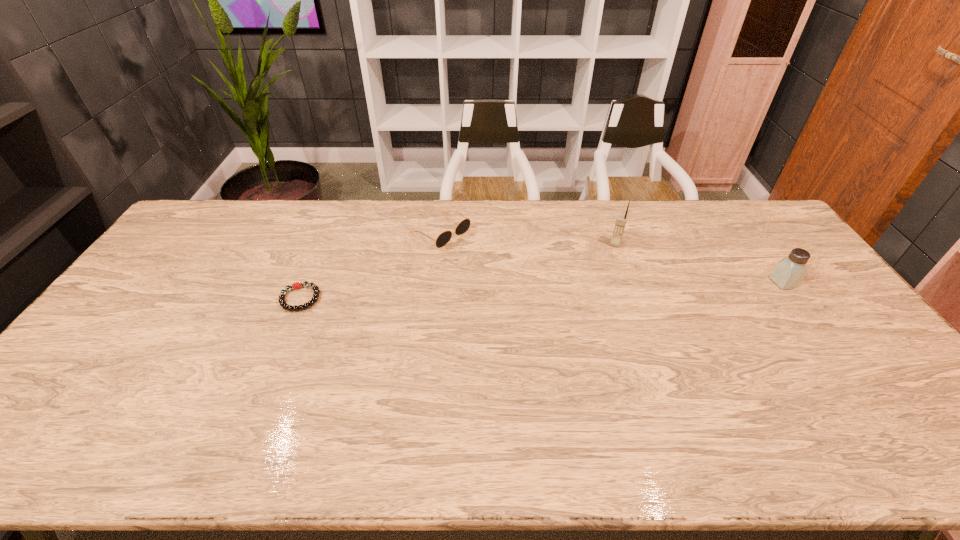
Locate an element on the screen. blank space located 0.360m on the front-facing side of the second object from left to right is located at coordinates (546, 296).

Find the location of `vacant point located on the front-facing side of the second object from left to right`. vacant point located on the front-facing side of the second object from left to right is located at coordinates (523, 282).

Image resolution: width=960 pixels, height=540 pixels. Find the location of `free region located on the front-facing side of the second object from left to right`. free region located on the front-facing side of the second object from left to right is located at coordinates (533, 288).

You are a GUI agent. You are given a task and a screenshot of the screen. Output one action in this format:
    pyautogui.click(x=<x>, y=<y>)
    Task: Click on the vacant space located on the front of the third object from left to right, where the keypad is located
    This screenshot has width=960, height=540.
    Given the screenshot: What is the action you would take?
    pyautogui.click(x=604, y=273)

Identify the location of free region located on the front of the third object from left to right, where the keypad is located. The width and height of the screenshot is (960, 540). (584, 325).

In order to click on vacant space positioned 0.230m on the front of the third object from left to right, where the keypad is located in this screenshot , I will do `click(597, 291)`.

Identify the location of object that is at the far edge. Image resolution: width=960 pixels, height=540 pixels. [464, 225].

The image size is (960, 540). In order to click on object present at the right edge in this screenshot , I will do `click(789, 272)`.

Where is `vacant space at the far edge of the desktop`? The image size is (960, 540). vacant space at the far edge of the desktop is located at coordinates (690, 227).

In order to click on free region at the near edge of the desktop in this screenshot , I will do `click(282, 416)`.